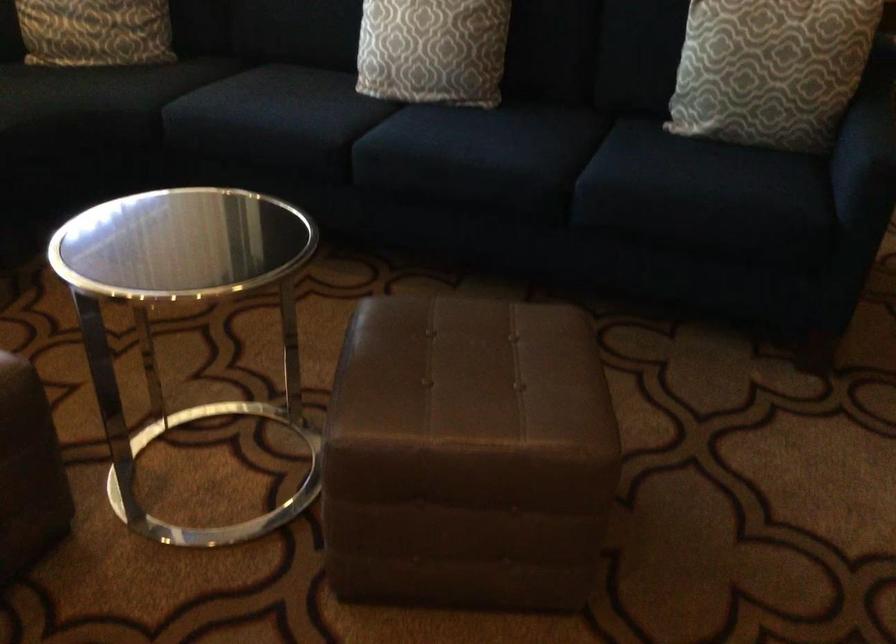
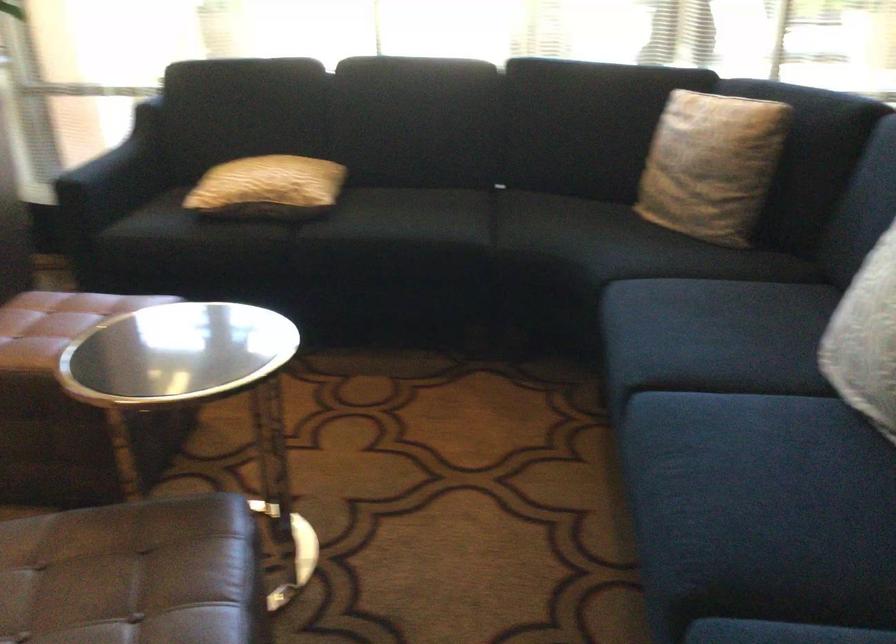
The point at [487,339] is marked in the first image. Where is the corresponding point in the second image?

(134, 574)